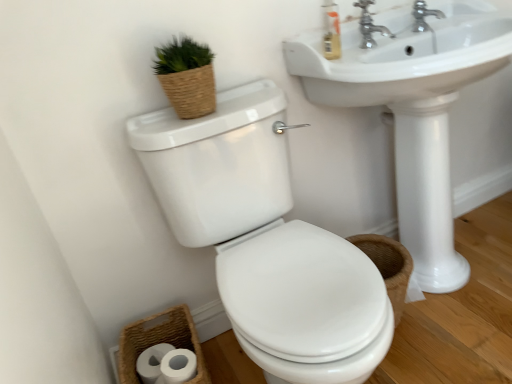
Question: Would you say woven brown basket at lower left is to the left or to the right of white glossy toilet at center in the picture?

Choices:
 (A) right
 (B) left

Answer: (B)

Question: Considering their positions, is woven brown basket at lower left located in front of or behind white glossy toilet at center?

Choices:
 (A) behind
 (B) front

Answer: (A)

Question: Which object is the closest to the woven brown basket at lower left?

Choices:
 (A) white glossy sink at center
 (B) white matte toilet paper at lower left
 (C) white glossy toilet at center
 (D) silver metallic faucet at upper right, the second tap positioned from the left
 (E) satin nickel faucet at upper right, the 2th tap from the right

Answer: (B)

Question: Which object is the closest to the translucent plastic soap dispenser at upper right?

Choices:
 (A) white glossy toilet at center
 (B) woven brown basket at lower left
 (C) silver metallic faucet at upper right, which appears as the first tap when viewed from the right
 (D) white matte toilet paper at lower left
 (E) white glossy sink at center

Answer: (C)